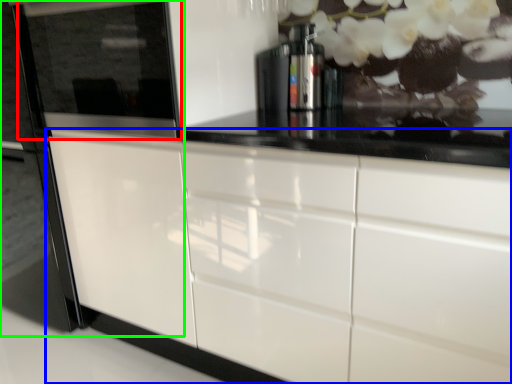
Question: Which object is positioned farthest from appliance (highlighted by a red box)? Select from cabinetry (highlighted by a blue box) and fridge (highlighted by a green box).

Choices:
 (A) cabinetry
 (B) fridge

Answer: (A)